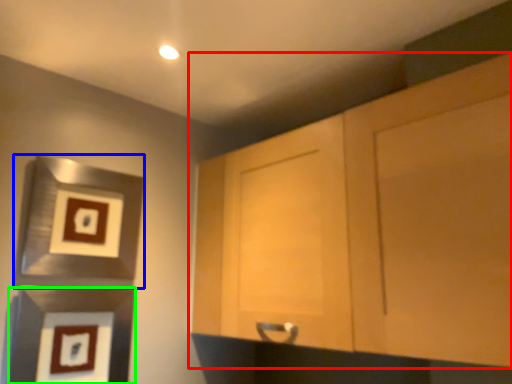
Question: Considering the real-world distances, which object is closest to cabinetry (highlighted by a red box)? picture frame (highlighted by a blue box) or picture frame (highlighted by a green box).

Choices:
 (A) picture frame
 (B) picture frame

Answer: (A)